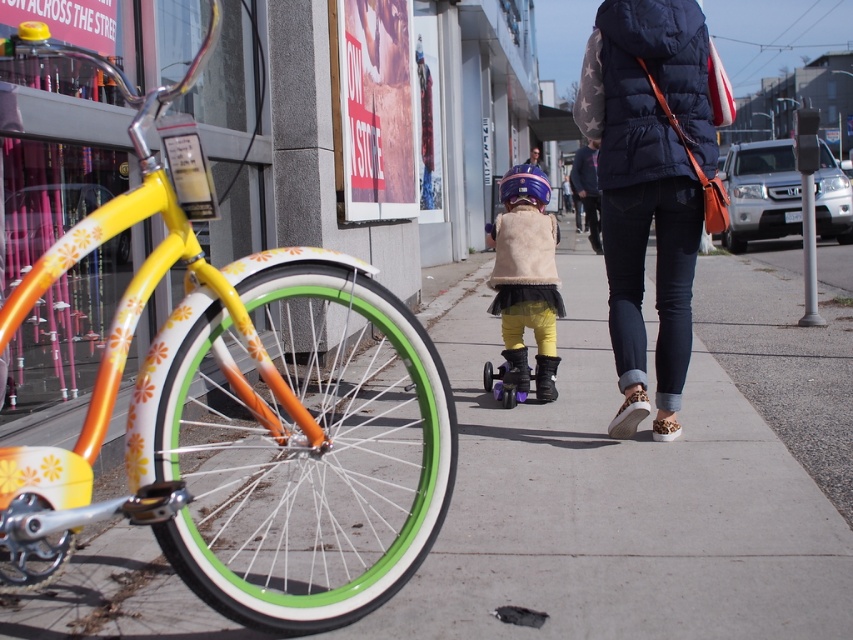
Does beige faux fur vest at center appear over purple matte roller skate at center?

Indeed, beige faux fur vest at center is positioned over purple matte roller skate at center.

Does beige faux fur vest at center have a greater width compared to purple matte roller skate at center?

Indeed, beige faux fur vest at center has a greater width compared to purple matte roller skate at center.

Which is in front, point (523, 252) or point (524, 358)?

Point (523, 252) is in front.

The image size is (853, 640). What are the coordinates of `beige faux fur vest at center` in the screenshot? It's located at (526, 276).

Is point (9, 506) less distant than point (625, 404)?

That is True.

Who is more forward, (123, 497) or (671, 88)?

Point (123, 497) is more forward.

Is point (248, 536) farther from camera compared to point (627, 93)?

That is False.

Where is `shiny yellow bicycle at left`? Image resolution: width=853 pixels, height=640 pixels. shiny yellow bicycle at left is located at coordinates coord(241,410).

Can you confirm if concrete sidewalk at center is positioned below dark blue puffer vest at center?

Correct, concrete sidewalk at center is located below dark blue puffer vest at center.

Who is more forward, [788,528] or [624,195]?

Point [788,528]

Locate an element on the screen. The height and width of the screenshot is (640, 853). concrete sidewalk at center is located at coordinates (643, 474).